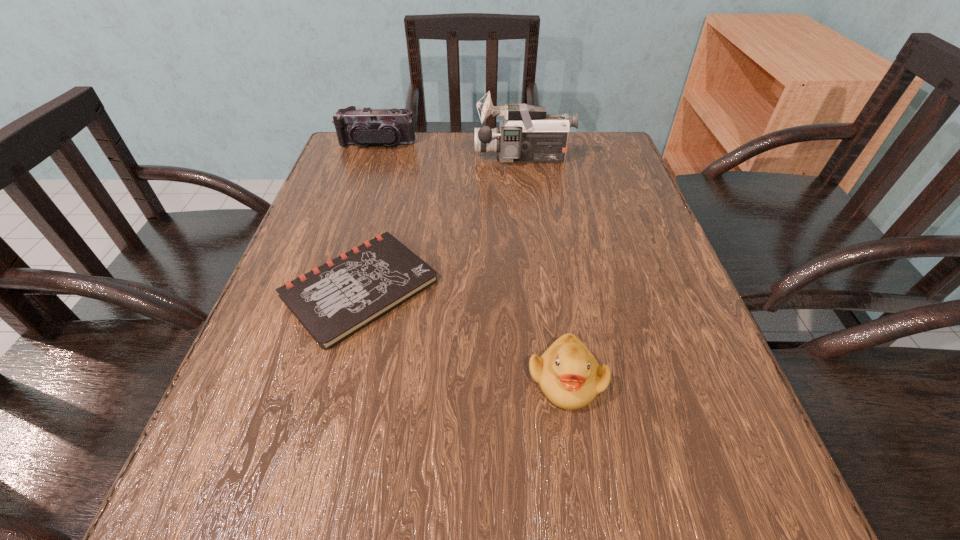
What are the coordinates of `object that can be found as the third closest to the notebook` in the screenshot? It's located at (366, 126).

Where is `object that is the second closest to the shortest object`? This screenshot has height=540, width=960. object that is the second closest to the shortest object is located at coordinates (527, 134).

The height and width of the screenshot is (540, 960). Find the location of `blank space that satisfies the following two spatial constraints: 1. on the front-facing side of the shorter camcorder; 2. on the left side of the shortest object`. blank space that satisfies the following two spatial constraints: 1. on the front-facing side of the shorter camcorder; 2. on the left side of the shortest object is located at coordinates (329, 288).